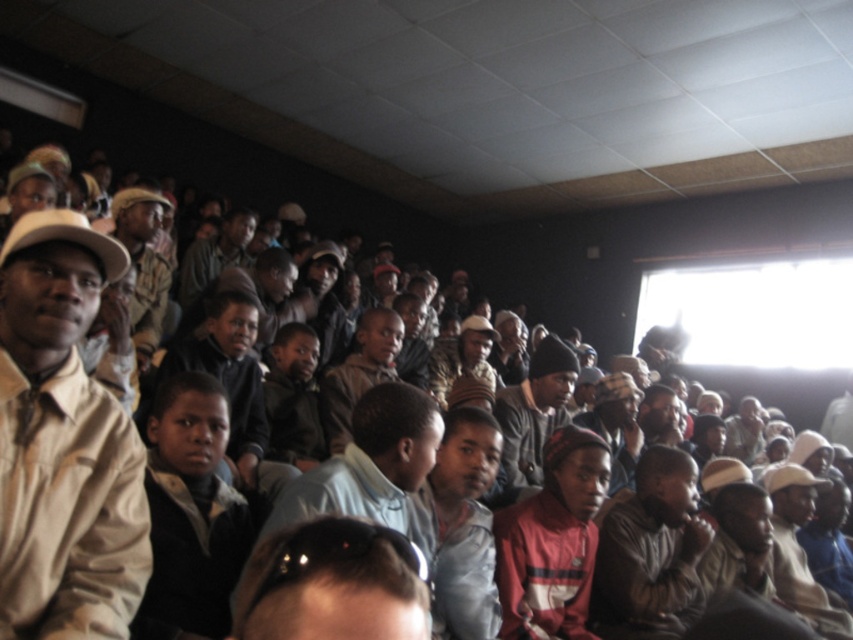
You are organizing a photo shoot in this auditorium and need to place a small tripod between the shiny black sunglasses at center and the light brown leather jacket at center. Given their sizes, will the space between them be sufficient for the tripod?

The shiny black sunglasses at center occupies less space than light brown leather jacket at center, so there is enough space between them to place the small tripod.

You are sitting in the front row of the auditorium and want to hand a note to the person wearing the light brown leather jacket at center and the dark gray jacket at center. Since you can only reach up to the third row, can you reach both of them?

The light brown leather jacket at center is below dark gray jacket at center, meaning they are in different rows. Since you can only reach up to the third row, you can reach the light brown leather jacket at center but not the dark gray jacket at center if they are in a higher row.